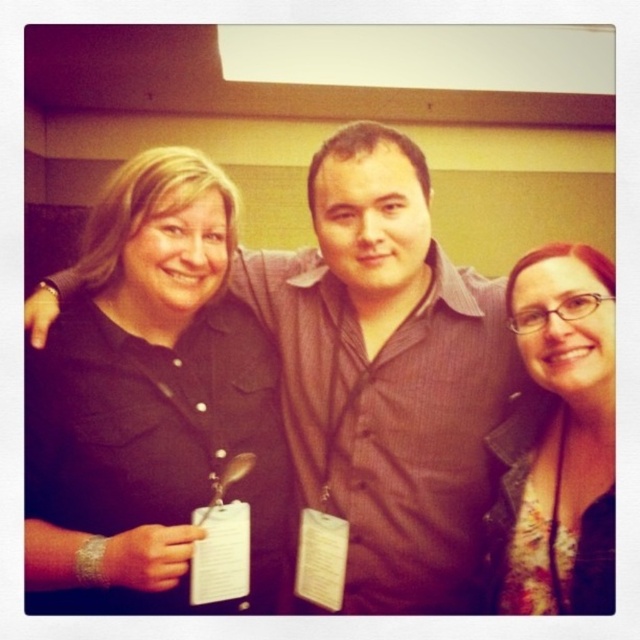
Question: Which point is farther to the camera?

Choices:
 (A) floral fabric shirt at center
 (B) black shirt at center

Answer: (B)

Question: In this image, where is black shirt at center located relative to floral fabric shirt at center?

Choices:
 (A) below
 (B) above

Answer: (B)

Question: Can you confirm if black shirt at center is positioned below floral fabric shirt at center?

Choices:
 (A) yes
 (B) no

Answer: (B)

Question: Where is black shirt at center located in relation to floral fabric shirt at center in the image?

Choices:
 (A) left
 (B) right

Answer: (A)

Question: Which point is farther to the camera?

Choices:
 (A) black shirt at center
 (B) floral fabric shirt at center

Answer: (A)